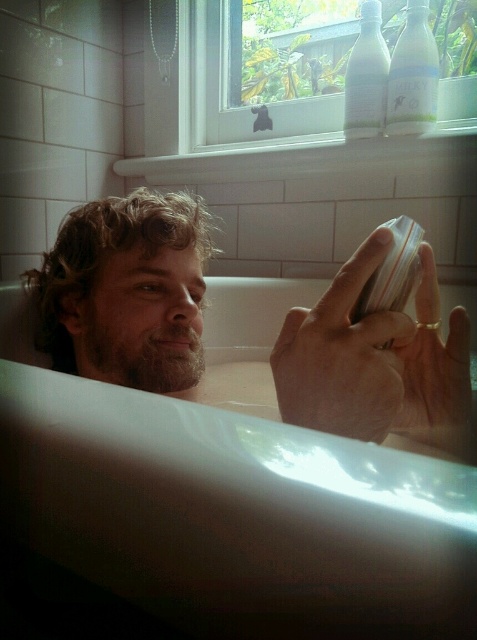
Question: Which point appears closest to the camera in this image?

Choices:
 (A) (300, 394)
 (B) (80, 268)
 (C) (475, 420)
 (D) (435, 356)

Answer: (A)

Question: Based on their relative distances, which object is nearer to the curly hair at left?

Choices:
 (A) smooth skin hand at center
 (B) white glossy bathtub at center
 (C) gold metallic ring at upper center

Answer: (C)

Question: Does curly hair at left lie behind smooth skin hand at center?

Choices:
 (A) no
 (B) yes

Answer: (B)

Question: Does white glossy bathtub at center lie behind smooth skin hand at center?

Choices:
 (A) yes
 (B) no

Answer: (B)

Question: Which of the following is the closest to the observer?

Choices:
 (A) smooth skin hand at center
 (B) gold metallic ring at upper center

Answer: (A)

Question: Is white glossy bathtub at center bigger than smooth skin hand at center?

Choices:
 (A) no
 (B) yes

Answer: (B)